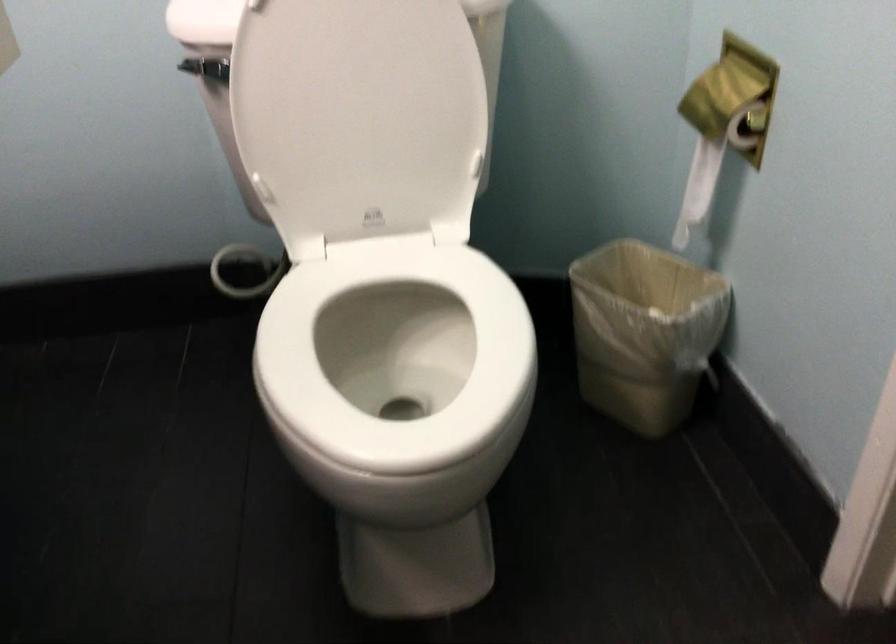
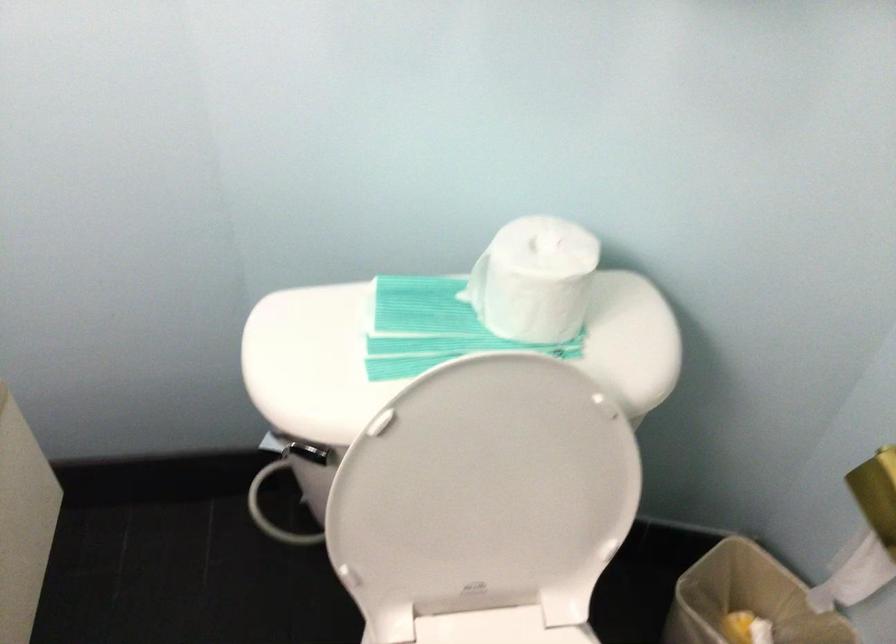
Question: The first image is from the beginning of the video and the second image is from the end. How did the camera likely rotate when shooting the video?

Choices:
 (A) Left
 (B) Right
 (C) Up
 (D) Down

Answer: (D)